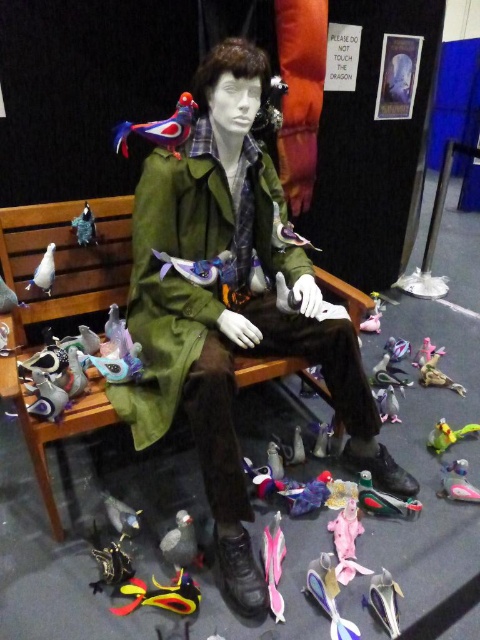
You are a child who wants to place a small toy between the rubberized yellow and black toy at lower center and the shiny metallic toy at lower right. If the toy you want to place is 20 centimeters long, will there be enough space between them?

The rubberized yellow and black toy at lower center is 65.77 centimeters from the shiny metallic toy at lower right. Since the toy you want to place is 20 centimeters long, there will be enough space between them because 65.77 cm is greater than 20 cm.

You are a child who wants to pick up the rubberized yellow and black toy at lower center. Can you reach it if you are standing 1.3 meters away from it?

The rubberized yellow and black toy at lower center is 1.38 meters away from the viewer. Since you are standing 1.3 meters away from it, you are closer than the toy, so you can reach it.